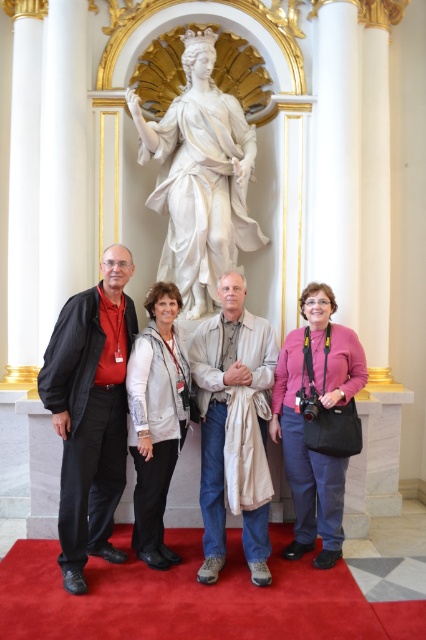
Question: Does white marble statue at center have a smaller size compared to pink fabric purse at center?

Choices:
 (A) yes
 (B) no

Answer: (B)

Question: Which point is closer to the camera taking this photo?

Choices:
 (A) (336, 401)
 (B) (123, 465)
 (C) (230, 241)

Answer: (A)

Question: Which object is the farthest from the pink fabric purse at center?

Choices:
 (A) silver metallic jacket at center
 (B) light beige fabric draped over man at center

Answer: (A)

Question: Which object is closer to the camera taking this photo?

Choices:
 (A) pink fabric purse at center
 (B) light beige fabric draped over man at center

Answer: (B)

Question: Is matte black jacket at left to the right of silver metallic jacket at center from the viewer's perspective?

Choices:
 (A) yes
 (B) no

Answer: (B)

Question: Is white marble statue at center positioned at the back of silver metallic jacket at center?

Choices:
 (A) no
 (B) yes

Answer: (B)